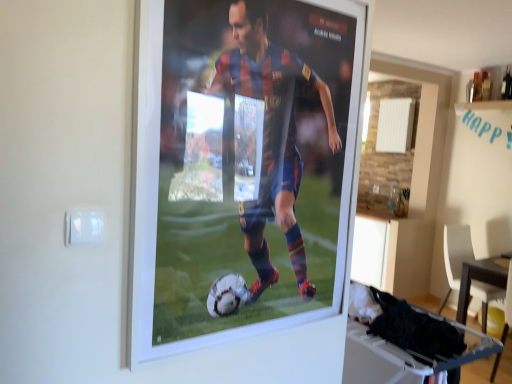
Question: Can you confirm if white plastic table at lower right, placed as the 2th table when sorted from back to front, is thinner than white plastic chair at lower right?

Choices:
 (A) no
 (B) yes

Answer: (B)

Question: Considering the relative positions of white plastic table at lower right, the 2th table when ordered from bottom to top, and white plastic chair at lower right in the image provided, is white plastic table at lower right, the 2th table when ordered from bottom to top, to the right of white plastic chair at lower right from the viewer's perspective?

Choices:
 (A) no
 (B) yes

Answer: (A)

Question: Does white plastic table at lower right, placed as the second table when sorted from right to left, turn towards white plastic chair at lower right?

Choices:
 (A) yes
 (B) no

Answer: (B)

Question: Does white plastic table at lower right, placed as the 2th table when sorted from back to front, contain white plastic chair at lower right?

Choices:
 (A) no
 (B) yes

Answer: (A)

Question: Is white plastic table at lower right, the 2th table when ordered from bottom to top, not close to white plastic chair at lower right?

Choices:
 (A) yes
 (B) no

Answer: (A)

Question: Considering the positions of white plastic chair at lower right and wooden table at lower right, arranged as the first table when viewed from the back, in the image, is white plastic chair at lower right bigger or smaller than wooden table at lower right, arranged as the first table when viewed from the back,?

Choices:
 (A) small
 (B) big

Answer: (A)

Question: From a real-world perspective, relative to wooden table at lower right, arranged as the 1th table when viewed from the right, is white plastic chair at lower right vertically above or below?

Choices:
 (A) below
 (B) above

Answer: (B)

Question: Visually, is white plastic chair at lower right positioned to the left or to the right of wooden table at lower right, the second table from the left?

Choices:
 (A) left
 (B) right

Answer: (A)

Question: Is white plastic chair at lower right spatially inside wooden table at lower right, arranged as the 1th table when viewed from the right, or outside of it?

Choices:
 (A) outside
 (B) inside

Answer: (A)

Question: From the image's perspective, is white plastic table at lower right, placed as the 2th table when sorted from back to front, above or below white plastic chair at lower right?

Choices:
 (A) above
 (B) below

Answer: (A)

Question: Based on their sizes in the image, would you say white plastic table at lower right, placed as the 1th table when sorted from top to bottom, is bigger or smaller than white plastic chair at lower right?

Choices:
 (A) big
 (B) small

Answer: (B)

Question: Considering the positions of white plastic table at lower right, which ranks as the 1th table in front-to-back order, and white plastic chair at lower right in the image, is white plastic table at lower right, which ranks as the 1th table in front-to-back order, taller or shorter than white plastic chair at lower right?

Choices:
 (A) short
 (B) tall

Answer: (A)

Question: In terms of width, does white plastic table at lower right, placed as the 1th table when sorted from top to bottom, look wider or thinner when compared to white plastic chair at lower right?

Choices:
 (A) thin
 (B) wide

Answer: (A)

Question: Looking at the image, does white plastic table at lower right, placed as the 2th table when sorted from back to front, seem bigger or smaller compared to wooden table at lower right, the second table positioned from the front?

Choices:
 (A) big
 (B) small

Answer: (B)

Question: Is white plastic table at lower right, placed as the 1th table when sorted from top to bottom, spatially inside wooden table at lower right, arranged as the first table when viewed from the back, or outside of it?

Choices:
 (A) outside
 (B) inside

Answer: (A)